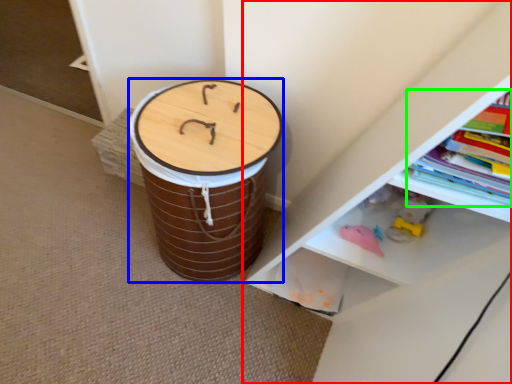
Question: Which object is positioned closest to shelf (highlighted by a red box)? Select from drum (highlighted by a blue box) and book (highlighted by a green box).

Choices:
 (A) drum
 (B) book

Answer: (B)